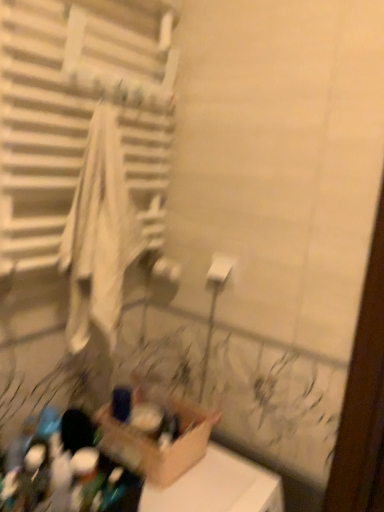
At what (x,y) coordinates should I click in order to perform the action: click on vacant area that lies to the right of cardboard box at lower center. Please return your answer as a coordinate pair (x, y). This screenshot has height=512, width=384. Looking at the image, I should click on (230, 477).